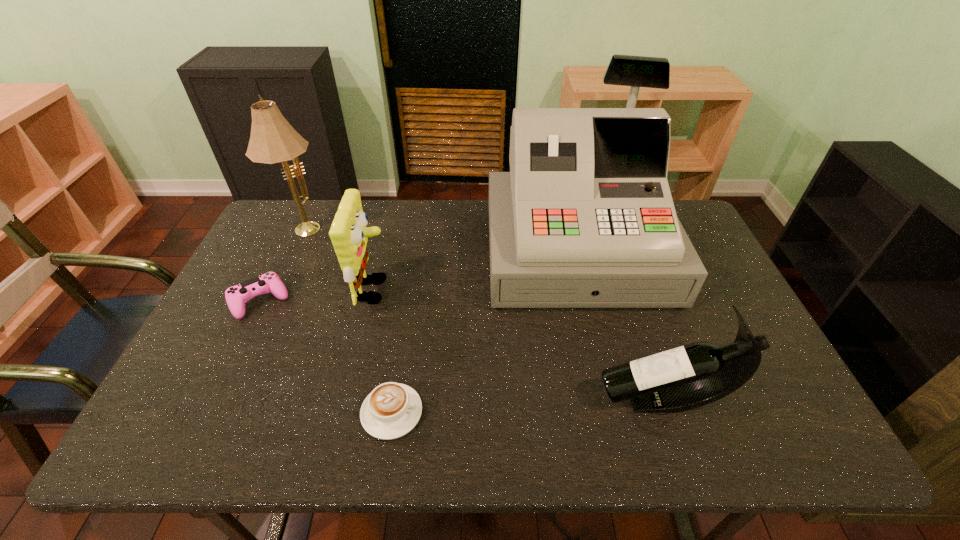
Locate an element on the screen. The image size is (960, 540). vacant space at the far right corner of the desktop is located at coordinates (688, 231).

This screenshot has width=960, height=540. Find the location of `free space between the sponge and the control`. free space between the sponge and the control is located at coordinates (318, 296).

This screenshot has width=960, height=540. Identify the location of vacant space in between the cappuccino and the second tallest object. (x=348, y=320).

You are a GUI agent. You are given a task and a screenshot of the screen. Output one action in this format:
    pyautogui.click(x=<x>, y=<y>)
    Task: Click on the vacant point located between the sponge and the cappuccino
    Image resolution: width=960 pixels, height=540 pixels.
    Given the screenshot: What is the action you would take?
    click(383, 351)

In order to click on free space between the sponge and the control in this screenshot , I will do `click(318, 296)`.

Locate an element on the screen. Image resolution: width=960 pixels, height=540 pixels. vacant space that is in between the wine bottle and the lampshade is located at coordinates (483, 313).

Locate an element on the screen. blank region between the cash register and the control is located at coordinates (418, 276).

Where is `blank region between the sponge and the cash register`? blank region between the sponge and the cash register is located at coordinates point(475,271).

This screenshot has height=540, width=960. Find the location of `free area in between the control and the wine bottle`. free area in between the control and the wine bottle is located at coordinates (461, 350).

Where is `vacant region between the control and the fifth shortest object`? The height and width of the screenshot is (540, 960). vacant region between the control and the fifth shortest object is located at coordinates (282, 264).